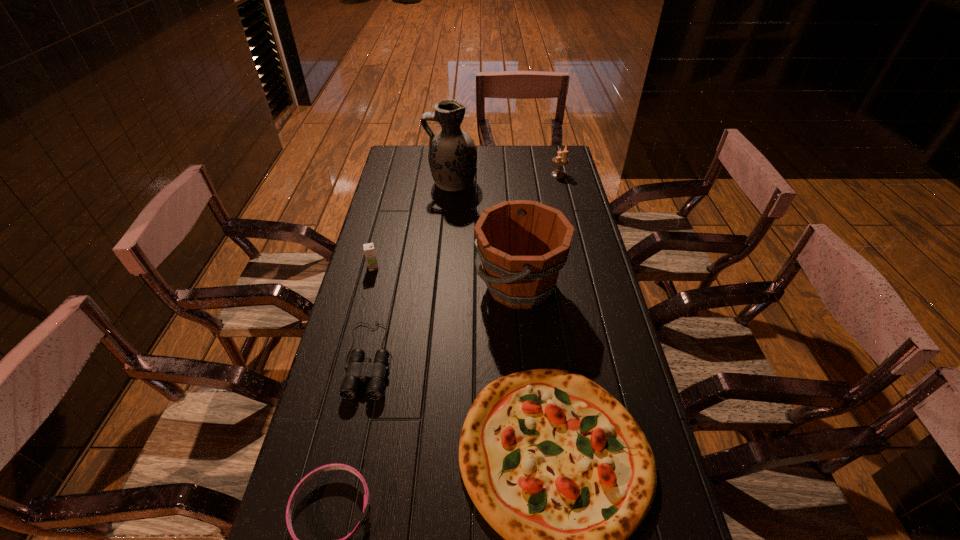
Find the location of `free space between the candle holder and the chocolate milk`. free space between the candle holder and the chocolate milk is located at coordinates (466, 221).

Point out which object is positioned as the nearest to the binoculars. Please provide its 2D coordinates. Your answer should be formatted as a tuple, i.e. [(x, y)], where the tuple contains the x and y coordinates of a point satisfying the conditions above.

[(336, 466)]

This screenshot has width=960, height=540. Identify the location of object that ranks as the second closest to the dog collar. 556,465.

Where is `vacant space that satisfies the following two spatial constraints: 1. on the handle side of the sixth shortest object; 2. at the eyepiece of the binoculars`? vacant space that satisfies the following two spatial constraints: 1. on the handle side of the sixth shortest object; 2. at the eyepiece of the binoculars is located at coordinates (526, 359).